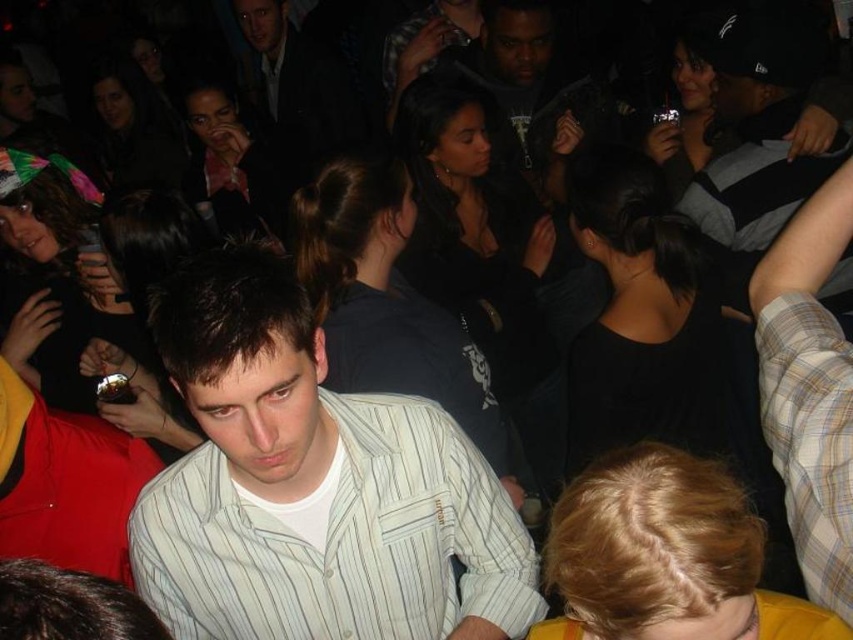
Between white striped shirt at center and striped shirt at upper right, which one has more height?

With more height is striped shirt at upper right.

How far apart are white striped shirt at center and striped shirt at upper right?

They are 1.64 meters apart.

Measure the distance between point (416, 548) and camera.

Point (416, 548) is 4.62 feet away from camera.

Locate an element on the screen. This screenshot has height=640, width=853. white striped shirt at center is located at coordinates [312, 486].